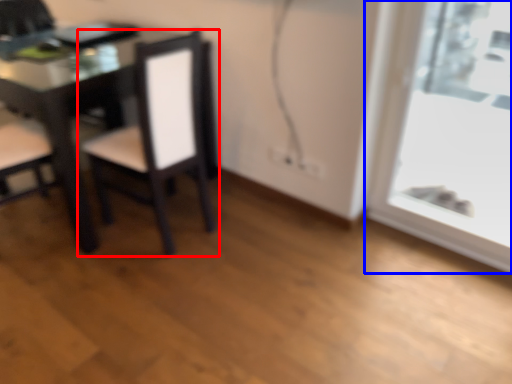
Question: Which object appears closest to the camera in this image, chair (highlighted by a red box) or window (highlighted by a blue box)?

Choices:
 (A) chair
 (B) window

Answer: (B)